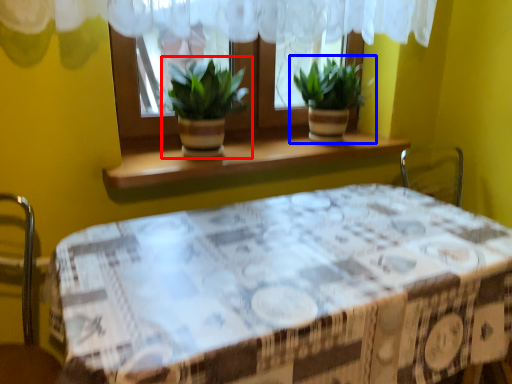
Question: Which of the following is the closest to the observer, houseplant (highlighted by a red box) or houseplant (highlighted by a blue box)?

Choices:
 (A) houseplant
 (B) houseplant

Answer: (A)